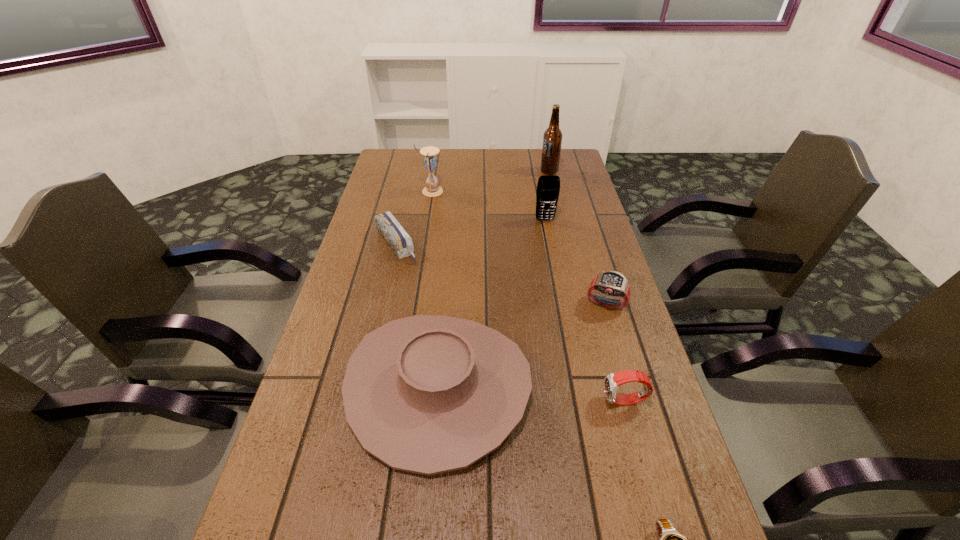
I want to click on vacant area located 0.170m on the label of the tallest object, so click(495, 171).

You are a GUI agent. You are given a task and a screenshot of the screen. Output one action in this format:
    pyautogui.click(x=<x>, y=<y>)
    Task: Click on the free region located on the label of the tallest object
    
    Given the screenshot: What is the action you would take?
    pyautogui.click(x=503, y=171)

What are the coordinates of `vacant point located on the back of the hourglass` in the screenshot? It's located at (436, 156).

Identify the location of free space located on the screen of the cellular telephone. (555, 275).

This screenshot has height=540, width=960. I want to click on vacant space located 0.100m on the front of the cowboy hat, so click(x=426, y=539).

Image resolution: width=960 pixels, height=540 pixels. What are the coordinates of `vacant area situated 0.280m on the face of the second nearest watch` in the screenshot? It's located at (470, 401).

Locate an element on the screen. The height and width of the screenshot is (540, 960). free space located 0.250m on the face of the second nearest watch is located at coordinates (485, 401).

I want to click on vacant space situated 0.090m on the face of the second nearest watch, so click(561, 401).

Locate an element on the screen. vacant area located 0.230m on the back of the fourth nearest object is located at coordinates (588, 241).

In order to click on free location located on the back of the second shortest object in this screenshot , I will do `click(403, 212)`.